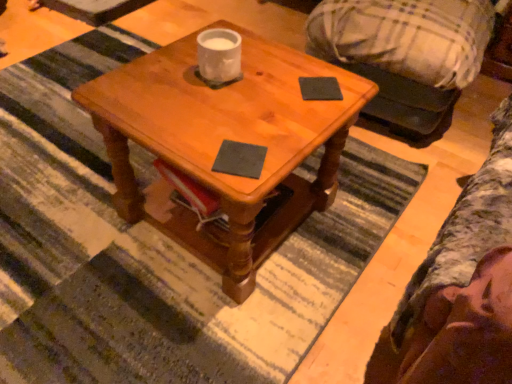
Question: Is the surface of wooden coffee table at center in direct contact with dark gray matte notepad at center, which is the 1th notepad from bottom to top?

Choices:
 (A) no
 (B) yes

Answer: (A)

Question: From the image's perspective, is wooden coffee table at center below dark gray matte notepad at center, which is the 1th notepad from bottom to top?

Choices:
 (A) yes
 (B) no

Answer: (B)

Question: Can you confirm if wooden coffee table at center is shorter than dark gray matte notepad at center, the 1th notepad in the front-to-back sequence?

Choices:
 (A) yes
 (B) no

Answer: (B)

Question: Does wooden coffee table at center turn towards dark gray matte notepad at center, the first notepad positioned from the left?

Choices:
 (A) yes
 (B) no

Answer: (B)

Question: From a real-world perspective, is wooden coffee table at center physically below dark gray matte notepad at center, the 1th notepad in the front-to-back sequence?

Choices:
 (A) no
 (B) yes

Answer: (B)

Question: Is the depth of wooden coffee table at center less than that of dark gray matte notepad at center, acting as the second notepad starting from the right?

Choices:
 (A) yes
 (B) no

Answer: (A)

Question: Considering the relative sizes of dark gray matte notepad at center, which is counted as the second notepad, starting from the back, and black matte notepad at upper right, the second notepad viewed from the front, in the image provided, is dark gray matte notepad at center, which is counted as the second notepad, starting from the back, taller than black matte notepad at upper right, the second notepad viewed from the front,?

Choices:
 (A) yes
 (B) no

Answer: (B)

Question: From a real-world perspective, is dark gray matte notepad at center, which is the second notepad from top to bottom, under black matte notepad at upper right, placed as the second notepad when sorted from bottom to top?

Choices:
 (A) yes
 (B) no

Answer: (A)

Question: From the image's perspective, would you say dark gray matte notepad at center, the 1th notepad in the front-to-back sequence, is shown under black matte notepad at upper right, placed as the 2th notepad when sorted from left to right?

Choices:
 (A) yes
 (B) no

Answer: (A)

Question: Are dark gray matte notepad at center, the 1th notepad in the front-to-back sequence, and black matte notepad at upper right, the second notepad viewed from the front, far apart?

Choices:
 (A) yes
 (B) no

Answer: (B)

Question: Is dark gray matte notepad at center, acting as the second notepad starting from the right, aimed at black matte notepad at upper right, placed as the second notepad when sorted from bottom to top?

Choices:
 (A) yes
 (B) no

Answer: (B)

Question: Considering the relative sizes of dark gray matte notepad at center, the 1th notepad in the front-to-back sequence, and black matte notepad at upper right, placed as the 2th notepad when sorted from left to right, in the image provided, is dark gray matte notepad at center, the 1th notepad in the front-to-back sequence, wider than black matte notepad at upper right, placed as the 2th notepad when sorted from left to right,?

Choices:
 (A) no
 (B) yes

Answer: (A)

Question: Is dark gray matte notepad at center, the first notepad positioned from the left, in contact with wooden coffee table at center?

Choices:
 (A) yes
 (B) no

Answer: (B)